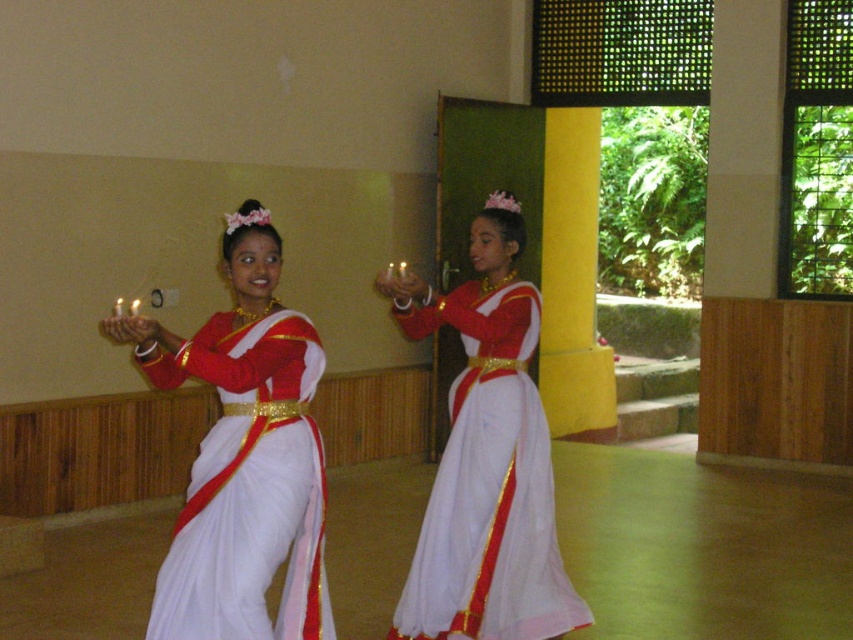
Between white silk saree at center and white satin sari at center, which one has more height?

white satin sari at center

What do you see at coordinates (248, 486) in the screenshot? I see `white silk saree at center` at bounding box center [248, 486].

Is point (224, 337) more distant than point (431, 531)?

No, it is not.

You are a GUI agent. You are given a task and a screenshot of the screen. Output one action in this format:
    pyautogui.click(x=<x>, y=<y>)
    Task: Click on the white silk saree at center
    This screenshot has width=853, height=640.
    Given the screenshot: What is the action you would take?
    pyautogui.click(x=248, y=486)